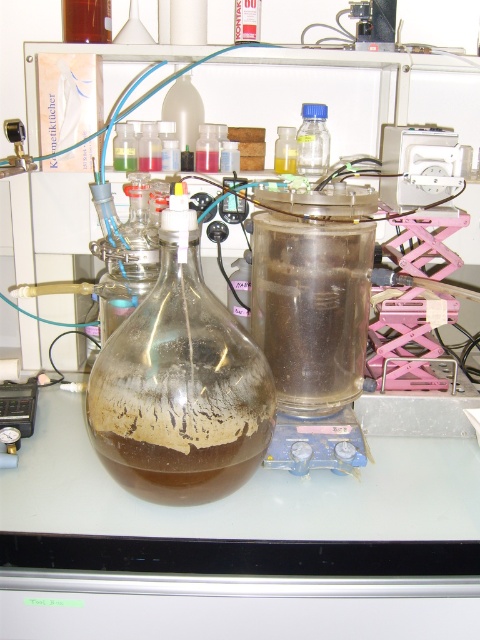
You are a lab assistant who needs to retrieve the transparent plastic bottle at upper center. To reach it, you must first move the translucent plastic test tube at center. Which direction should you move the test tube to clear the path?

The translucent plastic test tube at center is on the left side of the transparent plastic bottle at upper center. To clear the path, move the test tube to the right.

Based on the photo, you are a lab technician who needs to store a small sample in a container that doesn not take up much space. Which of the following would be the better option between the translucent plastic test tube at center and the transparent plastic bottle at upper center?

The translucent plastic test tube at center occupies less space than the transparent plastic bottle at upper center, so it would be the better option for storing a small sample without taking up much space.